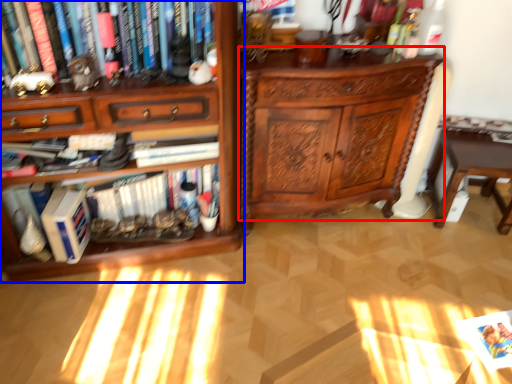
Question: Which object is closer to the camera taking this photo, chest of drawers (highlighted by a red box) or bookcase (highlighted by a blue box)?

Choices:
 (A) chest of drawers
 (B) bookcase

Answer: (B)